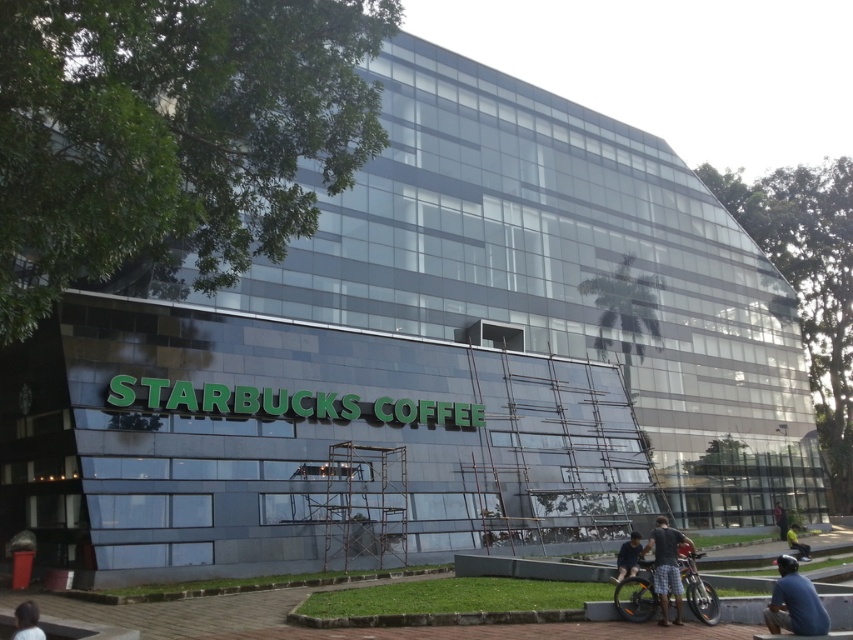
Does orange matte bicycle at lower right have a lesser height compared to dark blue shirt at lower left?

Yes.

Is orange matte bicycle at lower right further to the viewer compared to dark blue shirt at lower left?

Yes, it is behind dark blue shirt at lower left.

Who is more forward, (636, 589) or (39, 628)?

Point (39, 628) is in front.

Image resolution: width=853 pixels, height=640 pixels. In order to click on orange matte bicycle at lower right in this screenshot , I will do `click(636, 595)`.

Looking at this image, is blue fabric cap at lower right further to camera compared to plaid shorts at lower center?

No, it is in front of plaid shorts at lower center.

Is point (807, 598) positioned before point (682, 621)?

Yes, point (807, 598) is in front of point (682, 621).

This screenshot has height=640, width=853. What are the coordinates of `blue fabric cap at lower right` in the screenshot? It's located at (793, 602).

Which is above, plaid shorts at lower center or dark blue shirt at lower left?

dark blue shirt at lower left is above.

Based on the photo, measure the distance between plaid shorts at lower center and camera.

plaid shorts at lower center and camera are 10.70 meters apart from each other.

The height and width of the screenshot is (640, 853). Find the location of `plaid shorts at lower center`. plaid shorts at lower center is located at coordinates (666, 566).